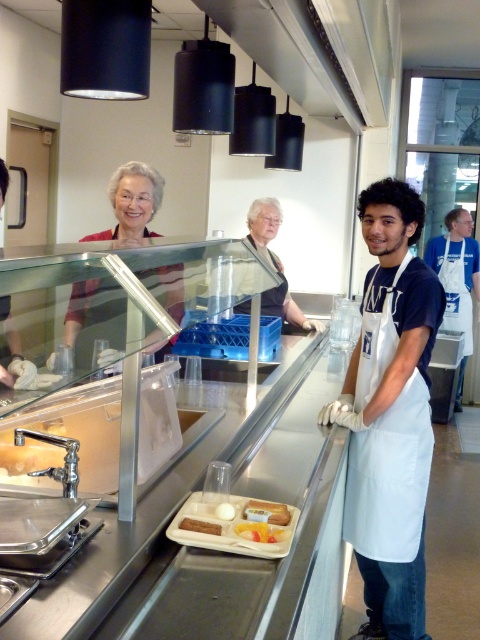
Does matte black sweater at upper center have a greater height compared to smooth plastic tray at center?

Indeed, matte black sweater at upper center has a greater height compared to smooth plastic tray at center.

Who is shorter, matte black sweater at upper center or smooth plastic tray at center?

smooth plastic tray at center

Locate an element on the screen. The width and height of the screenshot is (480, 640). matte black sweater at upper center is located at coordinates point(132,202).

Is matte black sweater at upper center bigger than yellow matte plastic tray at center?

Correct, matte black sweater at upper center is larger in size than yellow matte plastic tray at center.

Who is more forward, (88, 284) or (277, 536)?

Positioned in front is point (88, 284).

Find the location of a particular element. This screenshot has width=480, height=640. matte black sweater at upper center is located at coordinates (132, 202).

Does white apron at right appear on the right side of translucent plastic cup at center?

Yes, white apron at right is to the right of translucent plastic cup at center.

Between white apron at right and translucent plastic cup at center, which one appears on the left side from the viewer's perspective?

translucent plastic cup at center

Who is more forward, (458, 259) or (222, 518)?

Point (222, 518) is more forward.

Image resolution: width=480 pixels, height=640 pixels. I want to click on white apron at right, so click(x=456, y=280).